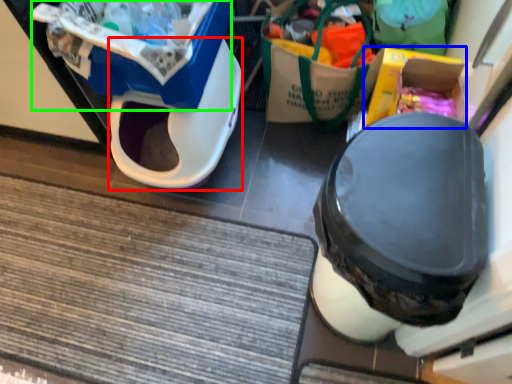
Question: Based on their relative distances, which object is nearer to wide (highlighted by a red box)? Choose from storage box (highlighted by a blue box) and storage box (highlighted by a green box).

Choices:
 (A) storage box
 (B) storage box

Answer: (B)